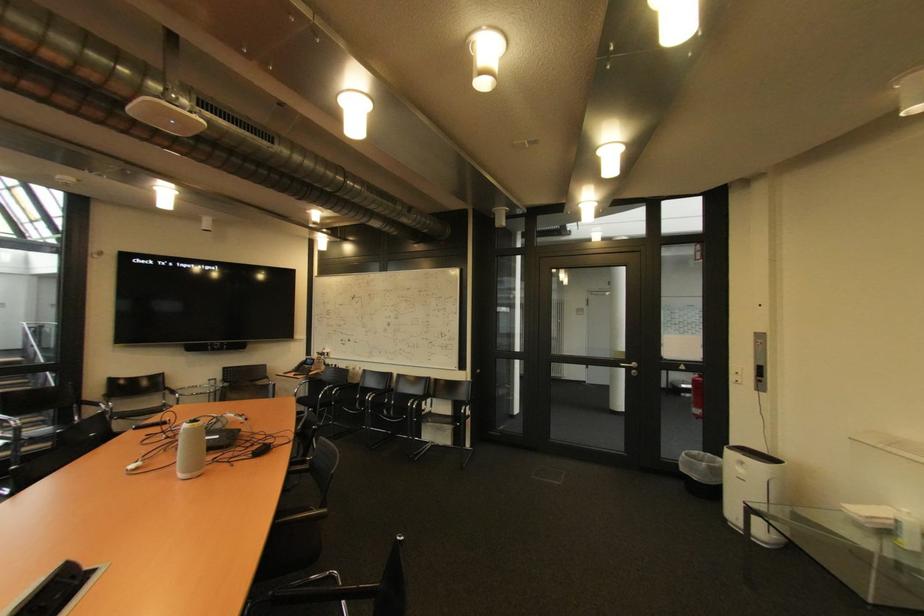
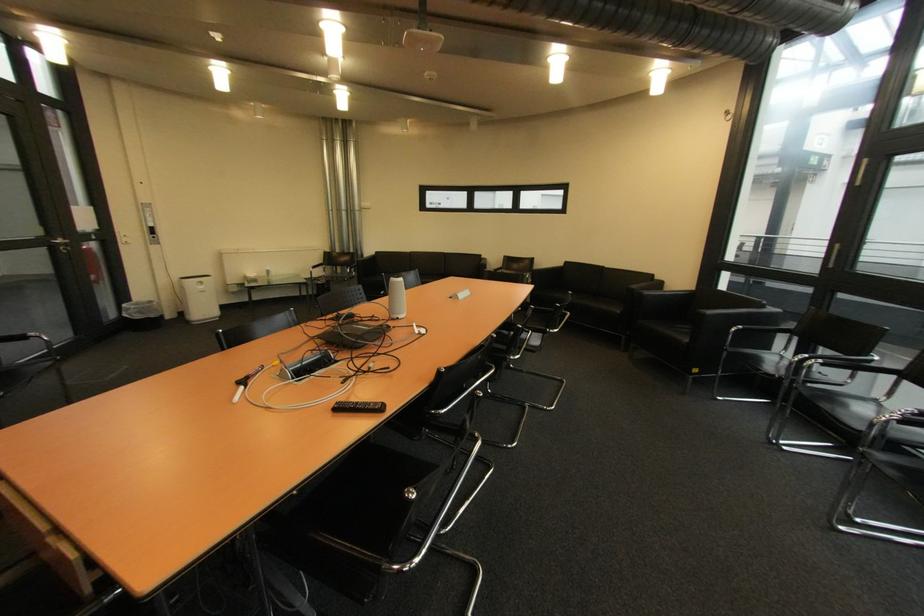
Locate, in the second image, the point that corresponds to (x=690, y=471) in the first image.

(147, 318)